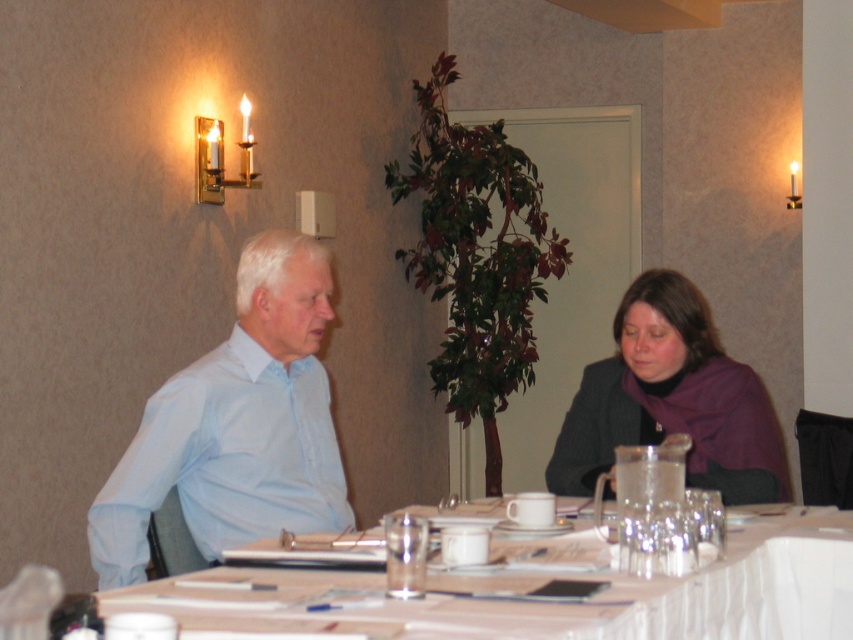
Question: Does white glossy table at center appear over purple wool scarf at lower right?

Choices:
 (A) no
 (B) yes

Answer: (A)

Question: Is light blue shirt at left further to camera compared to purple wool scarf at lower right?

Choices:
 (A) no
 (B) yes

Answer: (A)

Question: Which point is farther from the camera taking this photo?

Choices:
 (A) (758, 385)
 (B) (207, 474)
 (C) (252, 593)

Answer: (A)

Question: Does light blue shirt at center appear on the left side of purple wool scarf at lower right?

Choices:
 (A) yes
 (B) no

Answer: (A)

Question: Which of the following is the closest to the observer?

Choices:
 (A) light blue shirt at left
 (B) light blue shirt at center
 (C) white glossy table at center
 (D) purple wool scarf at lower right

Answer: (C)

Question: Which object appears farthest from the camera in this image?

Choices:
 (A) purple wool scarf at lower right
 (B) light blue shirt at center
 (C) light blue shirt at left
 (D) white glossy table at center

Answer: (A)